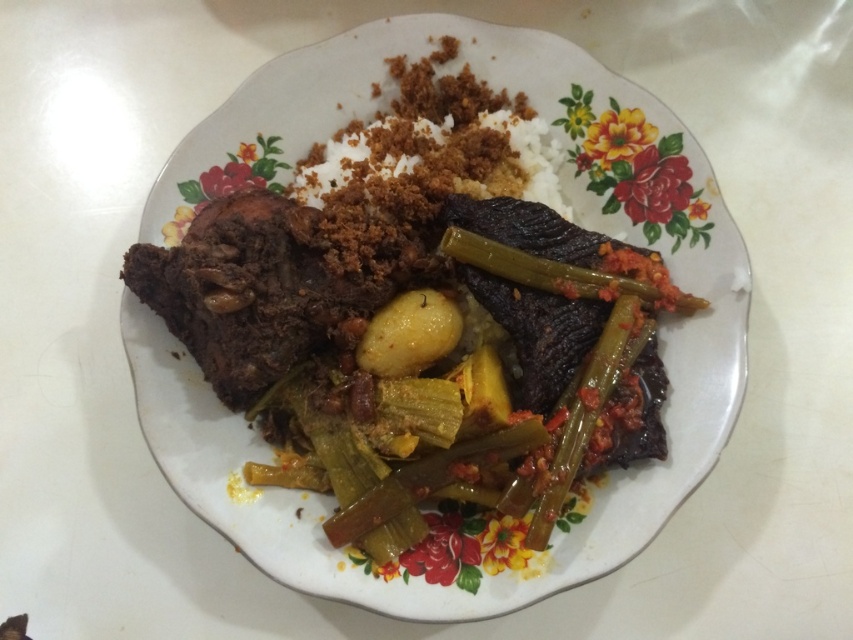
Which is in front, point (128, 356) or point (604, 332)?

Positioned in front is point (604, 332).

Is white glossy platter at center closer to camera compared to green glossy okra at center?

No, white glossy platter at center is further to the viewer.

Which is in front, point (514, 86) or point (556, 504)?

Positioned in front is point (556, 504).

Identify the location of white glossy platter at center. (331, 497).

Between white glossy platter at center and yellow matte potato at center, which one has less height?

Standing shorter between the two is yellow matte potato at center.

Who is higher up, white glossy platter at center or yellow matte potato at center?

white glossy platter at center is higher up.

I want to click on white glossy platter at center, so click(331, 497).

Locate an element on the screen. Image resolution: width=853 pixels, height=640 pixels. white glossy platter at center is located at coordinates click(x=331, y=497).

Can you confirm if green glossy okra at center is taller than yellow matte potato at center?

Yes, green glossy okra at center is taller than yellow matte potato at center.

Is green glossy okra at center to the left of yellow matte potato at center from the viewer's perspective?

Incorrect, green glossy okra at center is not on the left side of yellow matte potato at center.

Measure the distance between green glossy okra at center and camera.

green glossy okra at center and camera are 4.35 feet apart from each other.

The width and height of the screenshot is (853, 640). Identify the location of green glossy okra at center. (589, 406).